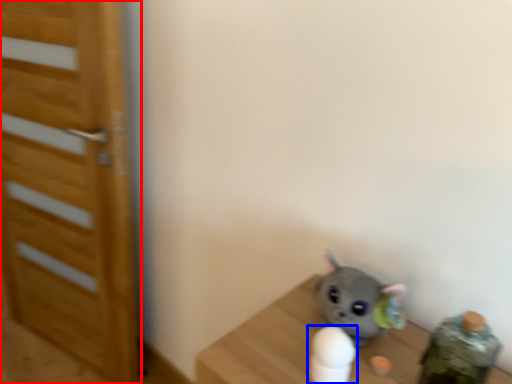
Question: Which object is closer to the camera taking this photo, door (highlighted by a red box) or toy (highlighted by a blue box)?

Choices:
 (A) door
 (B) toy

Answer: (B)